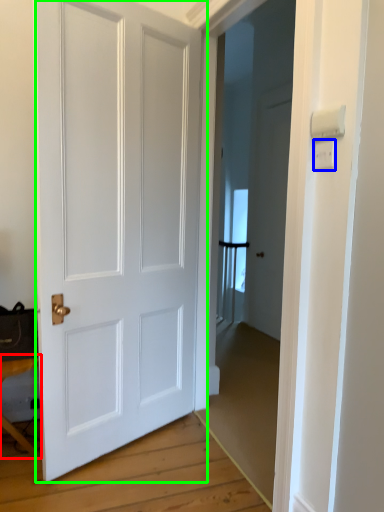
Question: Estimate the real-world distances between objects in this image. Which object is closer to table (highlighted by a red box), light switch (highlighted by a blue box) or door (highlighted by a green box)?

Choices:
 (A) light switch
 (B) door

Answer: (B)